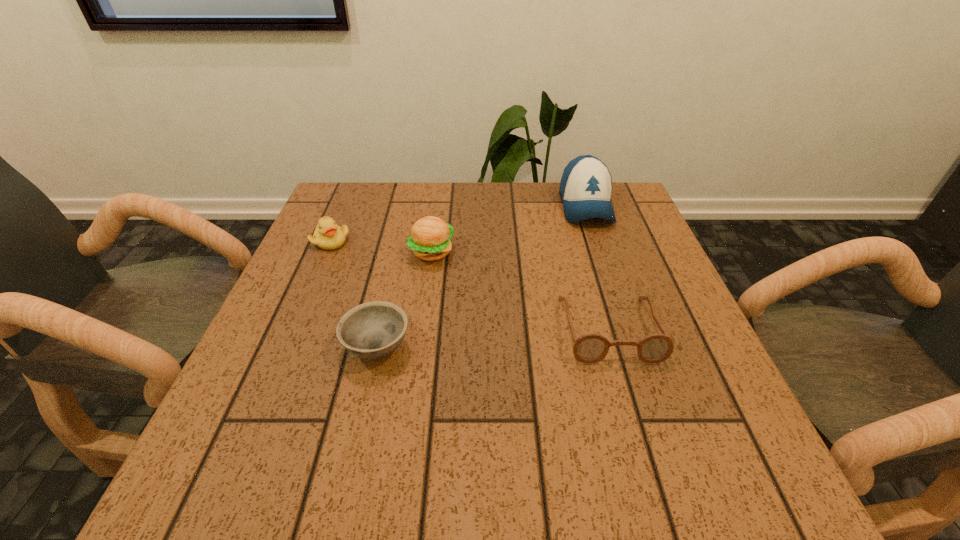
Choose which object is the nearest neighbor to the baseball cap. Please provide its 2D coordinates. Your answer should be formatted as a tuple, i.e. [(x, y)], where the tuple contains the x and y coordinates of a point satisfying the conditions above.

[(591, 348)]

Where is `the closest object to the leftmost object`? the closest object to the leftmost object is located at coordinates (430, 239).

At what (x,y) coordinates should I click in order to perform the action: click on vacant area that satisfies the following two spatial constraints: 1. on the front-facing side of the hamburger; 2. on the left side of the leftmost object. Please return your answer as a coordinate pair (x, y). The image size is (960, 540). Looking at the image, I should click on (326, 252).

Where is `vacant region that satisfies the following two spatial constraints: 1. on the front-facing side of the hamburger; 2. on the right side of the leftmost object`? Image resolution: width=960 pixels, height=540 pixels. vacant region that satisfies the following two spatial constraints: 1. on the front-facing side of the hamburger; 2. on the right side of the leftmost object is located at coordinates (326, 252).

In order to click on free point that satisfies the following two spatial constraints: 1. on the front-facing side of the bowl; 2. on the right side of the duckling in this screenshot , I will do `click(285, 347)`.

Where is `free space that satisfies the following two spatial constraints: 1. on the front-facing side of the hamburger; 2. on the right side of the duckling`? The height and width of the screenshot is (540, 960). free space that satisfies the following two spatial constraints: 1. on the front-facing side of the hamburger; 2. on the right side of the duckling is located at coordinates (326, 252).

Where is `free location that satisfies the following two spatial constraints: 1. on the front-facing side of the fourth shortest object; 2. on the left side of the leftmost object`? The width and height of the screenshot is (960, 540). free location that satisfies the following two spatial constraints: 1. on the front-facing side of the fourth shortest object; 2. on the left side of the leftmost object is located at coordinates point(326,252).